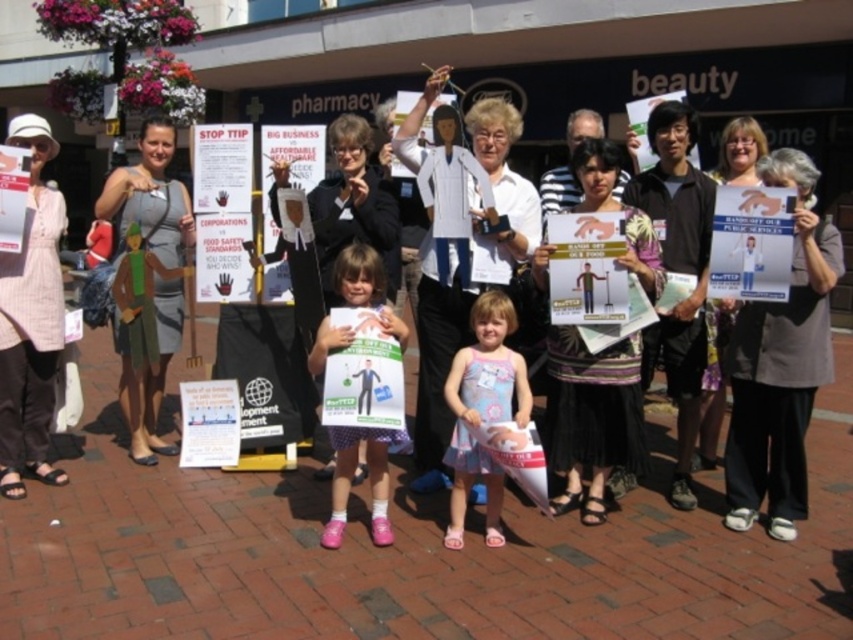
You are a photographer taking a picture of the protest scene. You notice two points marked in the image at coordinates point (564, 428) and point (129, 324). Which point is nearer to your camera lens?

Point (564, 428) is closer to the camera than point (129, 324).